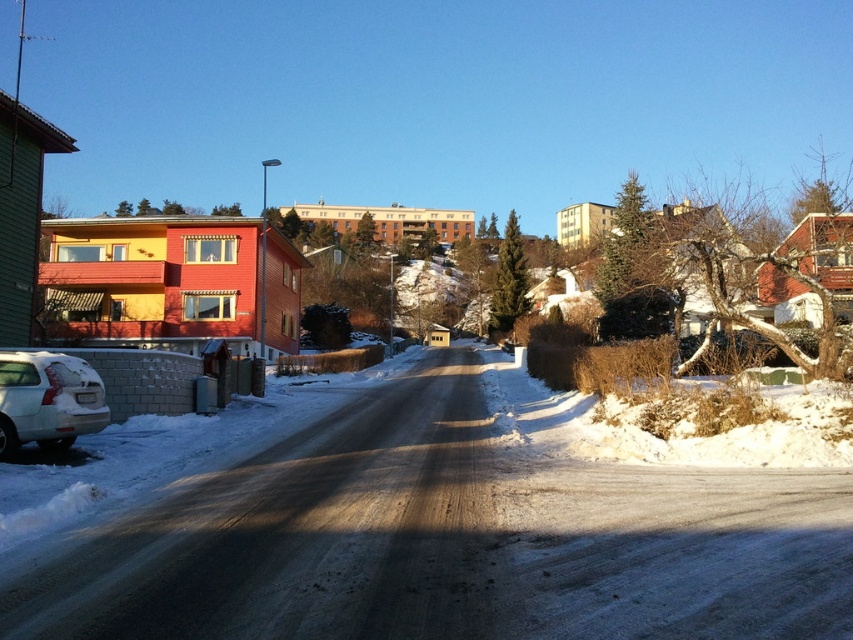
You are standing at the camera position looking at the winter scene. There are two points marked in the image, one at coordinate point (405, 465) and the other at point (33, 392). Which point is closer to you?

Point (33, 392) is closer to you because it is nearer to the camera than point (405, 465), which is further away.

You are a delivery person trying to reach the house on the left. The road is covered in white powdery snow at center, and there is a white matte car at lower left blocking your path. Can you drive around the car to reach the house?

The white powdery snow at center is in front of the white matte car at lower left, so you can drive around the car by going around it since the snow is in front of the car, not blocking the path.